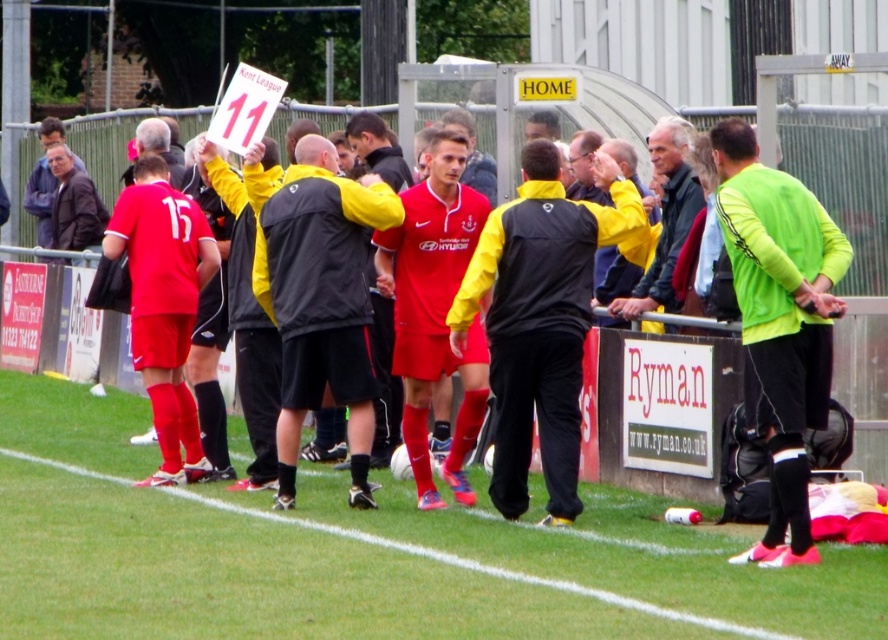
Question: Is neon green jersey at center wider than matte black jacket at center?

Choices:
 (A) no
 (B) yes

Answer: (A)

Question: Does neon green jersey at center appear over brown leather jacket at upper left?

Choices:
 (A) no
 (B) yes

Answer: (A)

Question: Among these points, which one is nearest to the camera?

Choices:
 (A) (194, 611)
 (B) (764, 244)
 (C) (378, 204)

Answer: (A)

Question: Which object appears farthest from the camera in this image?

Choices:
 (A) brown leather jacket at upper left
 (B) black matte jacket at center
 (C) neon green jersey at center

Answer: (A)

Question: Which object is farther from the camera taking this photo?

Choices:
 (A) dark brown leather jacket at left
 (B) dark gray jacket at center
 (C) green grass at center
 (D) matte black jacket at center

Answer: (A)

Question: Can you confirm if black matte jacket at center is thinner than matte black jacket at center?

Choices:
 (A) yes
 (B) no

Answer: (B)